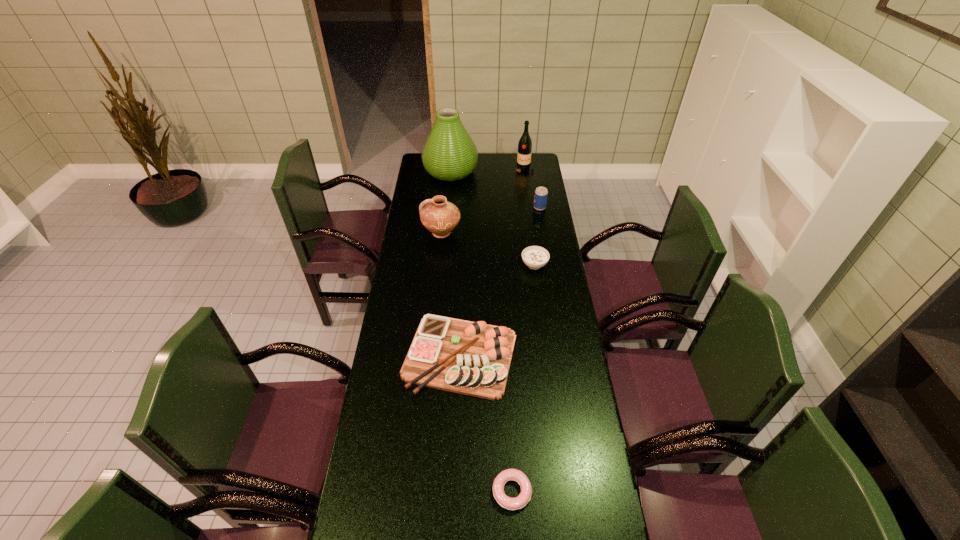
The height and width of the screenshot is (540, 960). Identify the location of the nearest object. (524, 497).

I want to click on the shortest object, so click(524, 497).

Locate an element on the screen. vacant area situated on the front of the vase is located at coordinates (445, 232).

Locate an element on the screen. This screenshot has height=540, width=960. vacant region located on the surface of the wine bottle is located at coordinates (531, 217).

Where is `vacant space located on the left of the beer can`? vacant space located on the left of the beer can is located at coordinates (492, 208).

At what (x,y) coordinates should I click in order to perform the action: click on free space located 0.090m on the back of the platter. Please return your answer as a coordinate pair (x, y). Looking at the image, I should click on (463, 300).

This screenshot has height=540, width=960. I want to click on free space located 0.120m on the front of the soup bowl, so click(x=539, y=294).

This screenshot has width=960, height=540. In order to click on blank area located 0.380m on the back of the shortest object in this screenshot , I will do `click(506, 365)`.

I want to click on vase located in the far edge section of the desktop, so click(x=449, y=154).

The image size is (960, 540). I want to click on wine bottle that is at the far edge, so click(x=525, y=143).